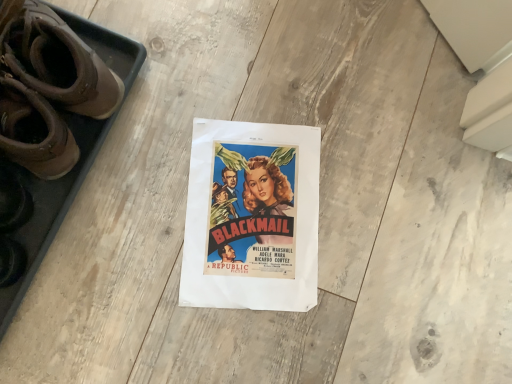
Question: Is brown leather boots at left taller or shorter than matte paper poster at center?

Choices:
 (A) short
 (B) tall

Answer: (B)

Question: Based on their positions, is brown leather boots at left located to the left or right of matte paper poster at center?

Choices:
 (A) right
 (B) left

Answer: (B)

Question: From a real-world perspective, is brown leather boots at left physically located above or below matte paper poster at center?

Choices:
 (A) above
 (B) below

Answer: (A)

Question: From a real-world perspective, is matte paper poster at center physically located above or below brown leather boots at left?

Choices:
 (A) above
 (B) below

Answer: (B)

Question: Is matte paper poster at center bigger or smaller than brown leather boots at left?

Choices:
 (A) big
 (B) small

Answer: (B)

Question: Is point (287, 201) positioned closer to the camera than point (22, 26)?

Choices:
 (A) closer
 (B) farther

Answer: (B)

Question: In terms of height, does matte paper poster at center look taller or shorter compared to brown leather boots at left?

Choices:
 (A) tall
 (B) short

Answer: (B)